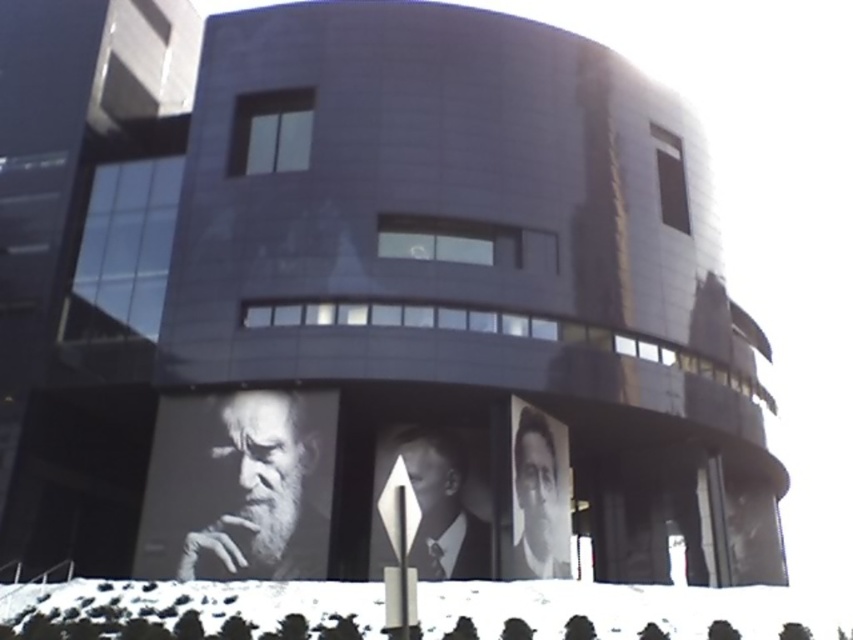
Question: Among these points, which one is farthest from the camera?

Choices:
 (A) (526, 497)
 (B) (317, 458)

Answer: (A)

Question: Is black and white portrait at center thinner than black and white portrait at lower right?

Choices:
 (A) no
 (B) yes

Answer: (B)

Question: Which object appears farthest from the camera in this image?

Choices:
 (A) black and white portrait at lower right
 (B) black and white portrait at center

Answer: (B)

Question: Which point is closer to the camera taking this photo?

Choices:
 (A) (294, 561)
 (B) (473, 568)

Answer: (A)

Question: Is black and white portrait at lower left to the left of black and white portrait at lower right from the viewer's perspective?

Choices:
 (A) yes
 (B) no

Answer: (A)

Question: Where is black and white portrait at lower left located in relation to black and white portrait at center in the image?

Choices:
 (A) below
 (B) above

Answer: (B)